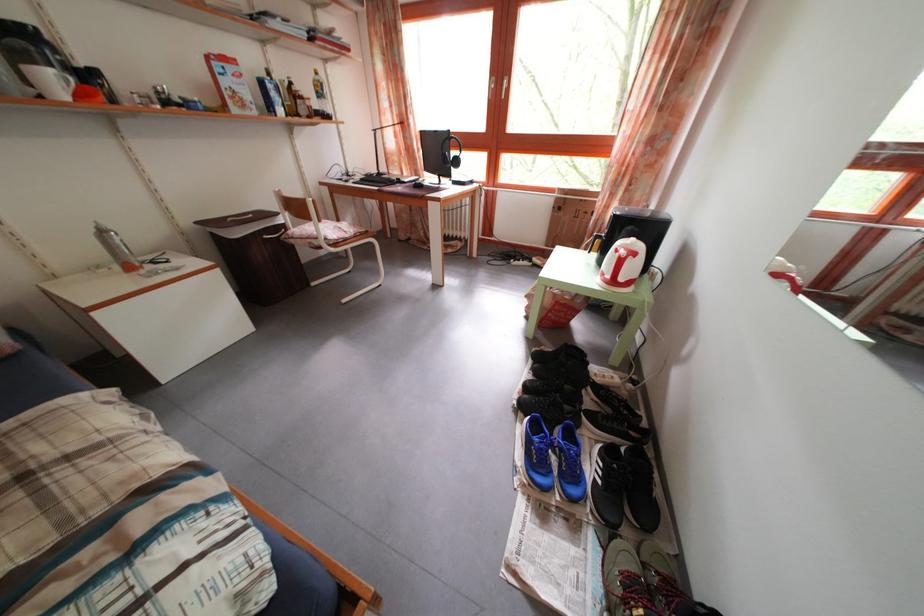
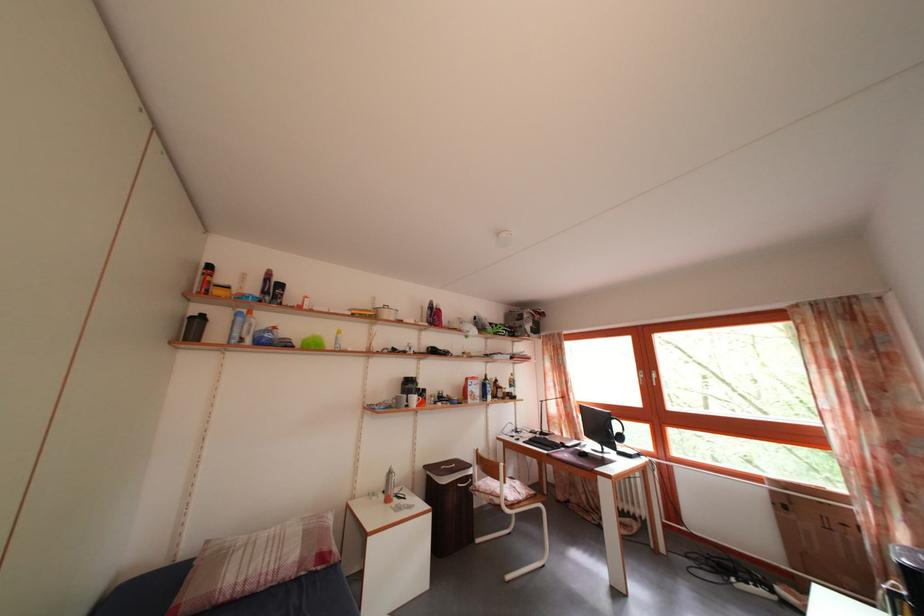
Locate, in the second image, the point that corresponds to point (318, 225) in the first image.

(505, 485)